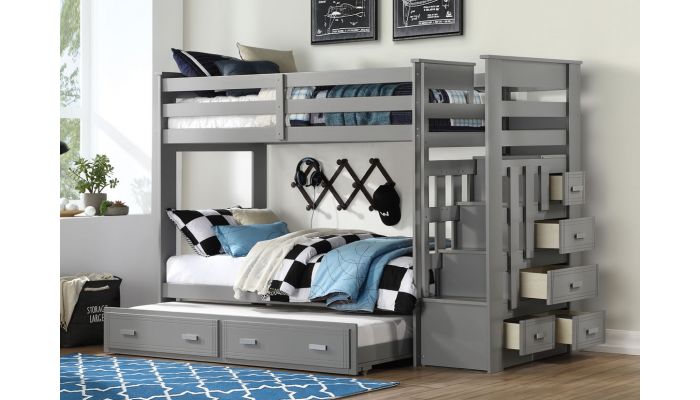
Locate an element on the screen. Image resolution: width=700 pixels, height=400 pixels. picture is located at coordinates (337, 18).